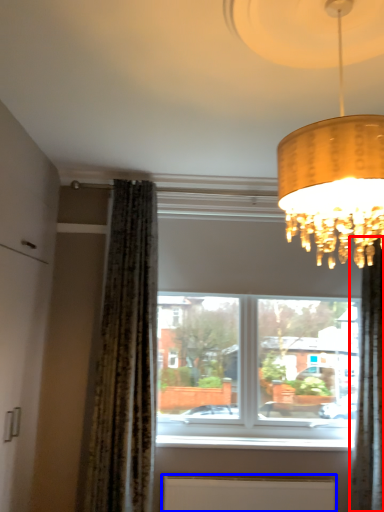
Question: Which object appears farthest to the camera in this image, curtain (highlighted by a red box) or radiator (highlighted by a blue box)?

Choices:
 (A) curtain
 (B) radiator

Answer: (B)